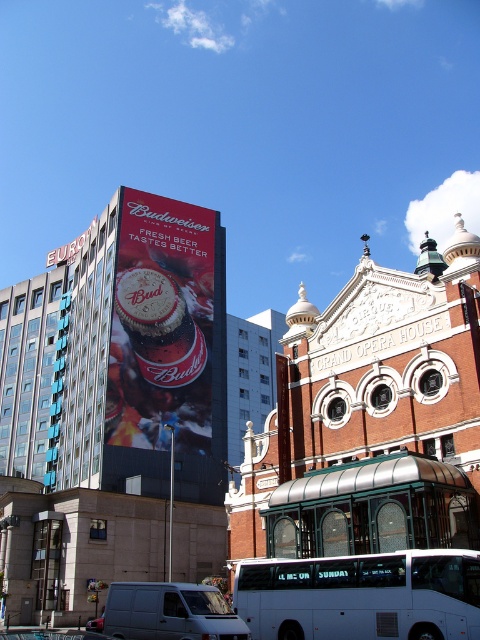
Question: Which of the following is the farthest from the observer?

Choices:
 (A) (87, 624)
 (B) (384, 628)
 (C) (169, 621)

Answer: (A)

Question: Estimate the real-world distances between objects in this image. Which object is closer to the white matte van at center?

Choices:
 (A) white matte bus at lower center
 (B) matte red beer can at upper center

Answer: (A)

Question: Which object is positioned closest to the metallic silver van at lower left?

Choices:
 (A) white matte van at center
 (B) white matte bus at lower center

Answer: (A)

Question: Where is matte red beer can at upper center located in relation to metallic silver van at lower left in the image?

Choices:
 (A) below
 (B) above

Answer: (B)

Question: Can you confirm if white matte van at center is positioned to the right of metallic silver van at lower left?

Choices:
 (A) yes
 (B) no

Answer: (A)

Question: Does matte red beer can at upper center appear on the right side of metallic silver van at lower left?

Choices:
 (A) yes
 (B) no

Answer: (A)